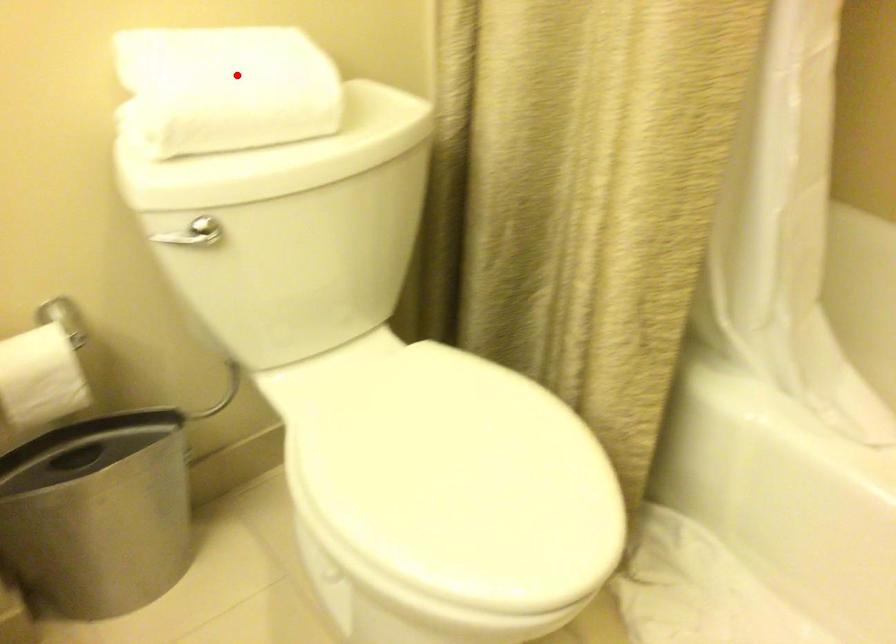
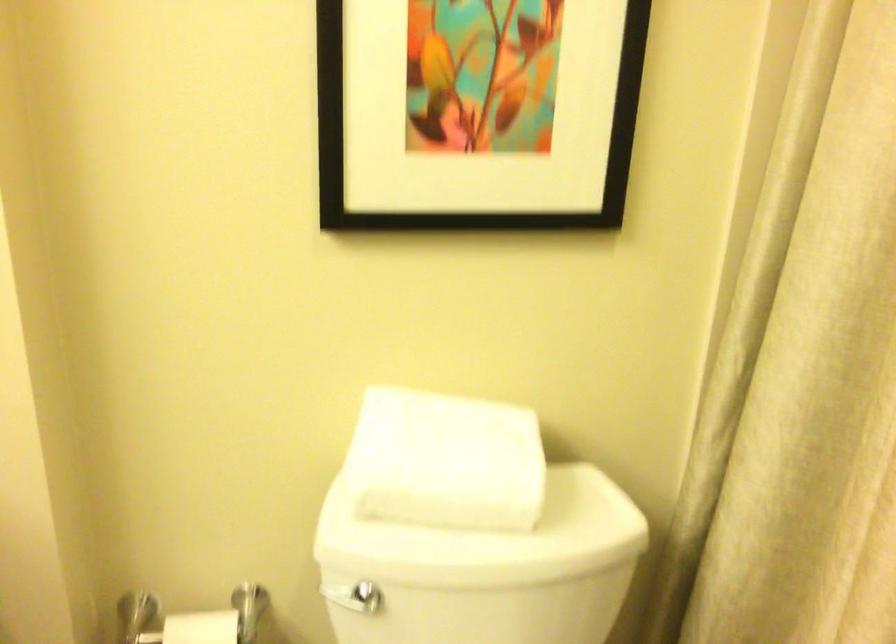
Where in the second image is the point corresponding to the highlighted location from the first image?

(445, 460)